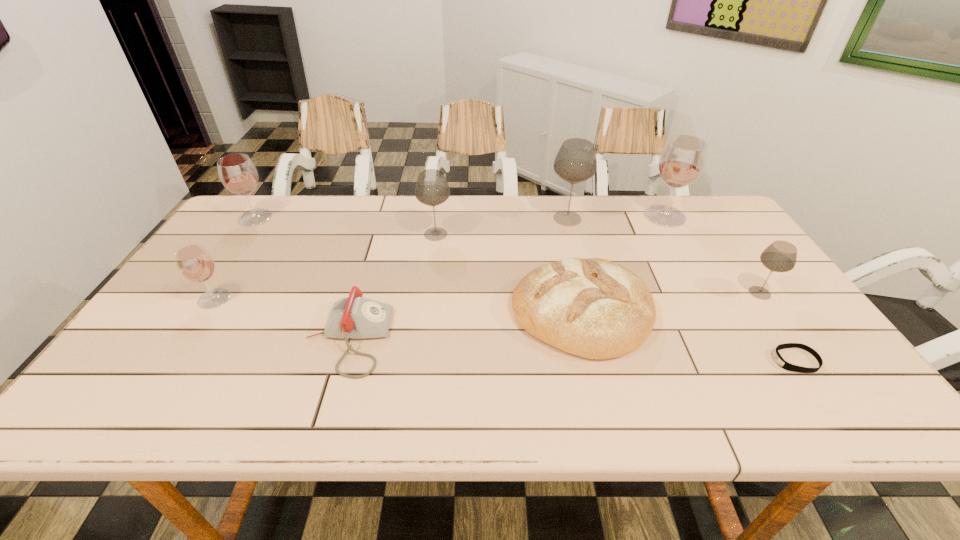
I want to click on the rightmost red wineglass, so click(683, 158).

The height and width of the screenshot is (540, 960). I want to click on the fifth wineglass from left to right, so click(x=683, y=158).

This screenshot has height=540, width=960. What are the coordinates of `the fourth wineglass from left to right` in the screenshot? It's located at (575, 162).

Where is `the second gray wineglass from right to left`? the second gray wineglass from right to left is located at coordinates (575, 162).

Where is `the second biggest red wineglass`? The width and height of the screenshot is (960, 540). the second biggest red wineglass is located at coordinates (237, 172).

What are the coordinates of `the leftmost gray wineglass` in the screenshot? It's located at (432, 189).

Locate an element on the screen. The width and height of the screenshot is (960, 540). the sixth object from right to left is located at coordinates (432, 189).

Where is `the smallest red wineglass`? the smallest red wineglass is located at coordinates (195, 263).

Where is `the rightmost gray wineglass`? The width and height of the screenshot is (960, 540). the rightmost gray wineglass is located at coordinates (780, 256).

You are a GUI agent. You are given a task and a screenshot of the screen. Output one action in this format:
    pyautogui.click(x=<x>, y=<y>)
    Task: Click on the rightmost wineglass
    
    Given the screenshot: What is the action you would take?
    pyautogui.click(x=780, y=256)